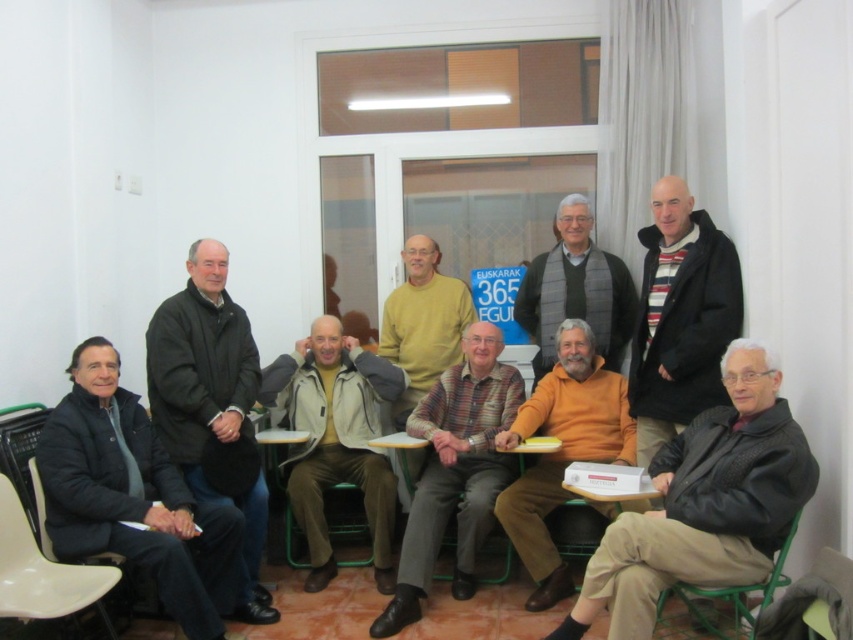
Describe the element at coordinates (704, 504) in the screenshot. I see `dark brown leather jacket at lower right` at that location.

Does point (813, 458) come in front of point (289, 476)?

Yes, it is.

Measure the distance between dark brown leather jacket at lower right and camera.

dark brown leather jacket at lower right is 2.70 meters from camera.

Identify the location of dark brown leather jacket at lower right. (704, 504).

Does point (407, 376) come in front of point (672, 593)?

That is False.

Based on the photo, who is more forward, (428, 275) or (782, 545)?

Positioned in front is point (782, 545).

I want to click on yellow matte sweater at center, so click(x=422, y=323).

Who is positioned more to the left, plaid fabric shirt at center or orange sweater at center?

plaid fabric shirt at center is more to the left.

Is plaid fabric shirt at center positioned in front of orange sweater at center?

Yes, plaid fabric shirt at center is in front of orange sweater at center.

Where is `plaid fabric shirt at center`? plaid fabric shirt at center is located at coordinates (456, 472).